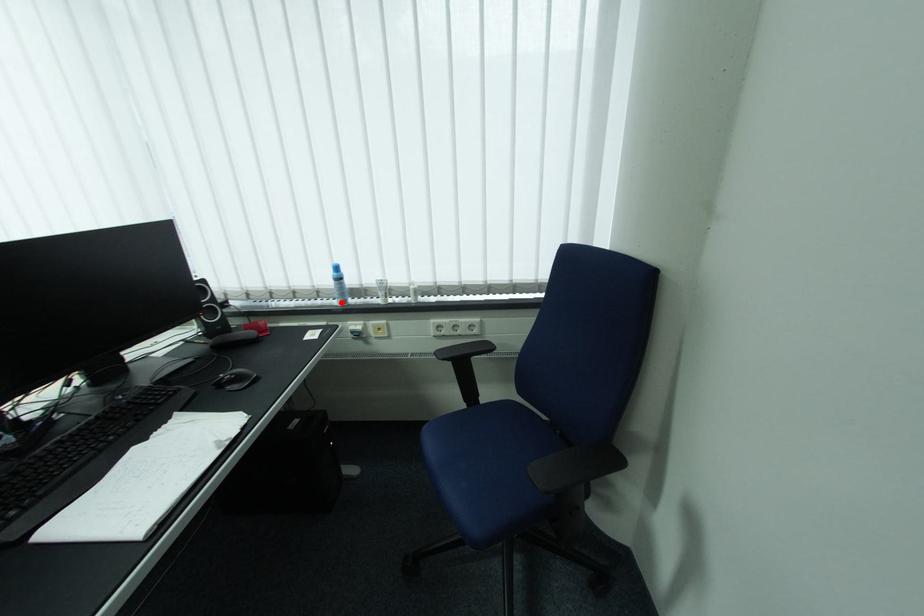
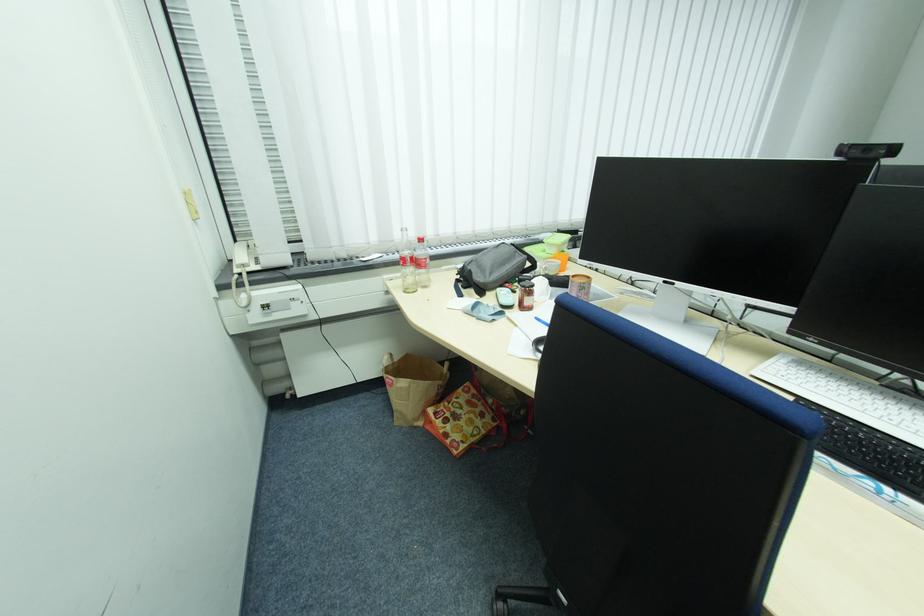
Question: I am providing you with two images of the same scene from different viewpoints. A red point is marked on the first image. Is the red point's position out of view in image 2?

Choices:
 (A) Yes
 (B) No

Answer: (A)